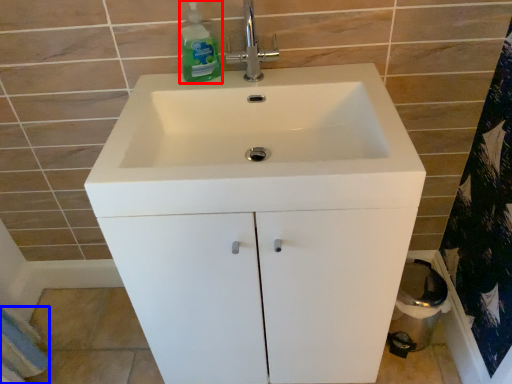
Question: Which object is closer to the camera taking this photo, cleaning product (highlighted by a red box) or bath towel (highlighted by a blue box)?

Choices:
 (A) cleaning product
 (B) bath towel

Answer: (A)